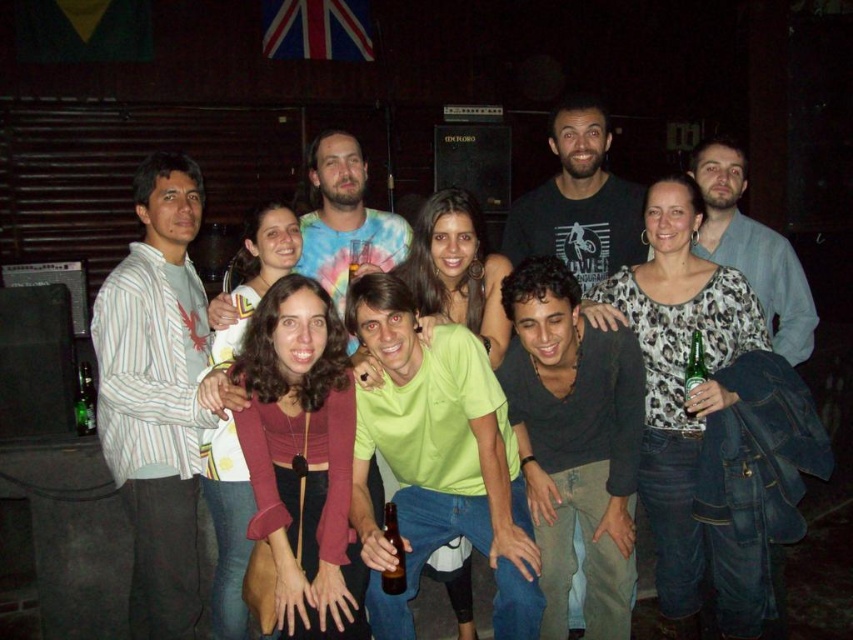
Is black matte shirt at center bigger than green glass bottle at center?

Yes, black matte shirt at center is bigger than green glass bottle at center.

The height and width of the screenshot is (640, 853). Identify the location of black matte shirt at center. (573, 442).

This screenshot has width=853, height=640. Find the location of `black matte shirt at center`. black matte shirt at center is located at coordinates (573, 442).

Can you confirm if green glass bottle at lower left is positioned to the right of green glass bottle at center?

In fact, green glass bottle at lower left is to the left of green glass bottle at center.

This screenshot has width=853, height=640. I want to click on green glass bottle at lower left, so click(x=84, y=401).

Find the location of `green glass bottle at lower left`. green glass bottle at lower left is located at coordinates (84, 401).

I want to click on green glass bottle at lower left, so click(x=84, y=401).

Who is positioned more to the right, white striped shirt at left or green glass bottle at lower left?

Positioned to the right is white striped shirt at left.

How far apart are white striped shirt at left and green glass bottle at lower left?

white striped shirt at left is 33.86 inches from green glass bottle at lower left.

Is point (170, 195) positioned after point (88, 372)?

No, it is in front of (88, 372).

Locate an element on the screen. Image resolution: width=853 pixels, height=640 pixels. white striped shirt at left is located at coordinates (158, 394).